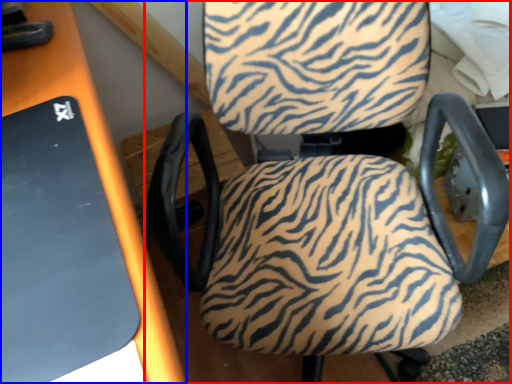
Question: Which object is further to the camera taking this photo, chair (highlighted by a red box) or table (highlighted by a blue box)?

Choices:
 (A) chair
 (B) table

Answer: (B)